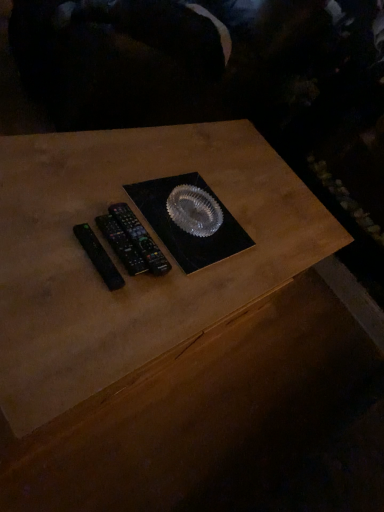
Question: Is black plastic remote at left, the second control from the back, completely or partially inside black plastic remote controls at center, which is the 1th control from back to front?

Choices:
 (A) yes
 (B) no

Answer: (B)

Question: Is black plastic remote controls at center, which is the 1th control from back to front, smaller than black plastic remote at left, positioned as the second control in front-to-back order?

Choices:
 (A) yes
 (B) no

Answer: (B)

Question: Considering the relative sizes of black plastic remote controls at center, acting as the 3th control starting from the front, and black plastic remote at left, the second control from the back, in the image provided, is black plastic remote controls at center, acting as the 3th control starting from the front, thinner than black plastic remote at left, the second control from the back,?

Choices:
 (A) yes
 (B) no

Answer: (B)

Question: Is black plastic remote controls at center, which is the 1th control from back to front, at the right side of black plastic remote at left, the second control from the back?

Choices:
 (A) no
 (B) yes

Answer: (B)

Question: From the image's perspective, is black plastic remote controls at center, which is the 1th control from back to front, below black plastic remote at left, positioned as the second control in front-to-back order?

Choices:
 (A) no
 (B) yes

Answer: (A)

Question: In terms of height, does black plastic remote at left, the 1th control viewed from the front, look taller or shorter compared to black plastic remote at left, the second control from the back?

Choices:
 (A) short
 (B) tall

Answer: (A)

Question: Is point (97, 245) positioned closer to the camera than point (142, 263)?

Choices:
 (A) farther
 (B) closer

Answer: (B)

Question: In the image, is black plastic remote at left, the 1th control viewed from the front, positioned in front of or behind black plastic remote at left, the second control from the back?

Choices:
 (A) front
 (B) behind

Answer: (A)

Question: From a real-world perspective, is black plastic remote at left, placed as the third control when sorted from back to front, positioned above or below black plastic remote at left, the second control from the back?

Choices:
 (A) above
 (B) below

Answer: (A)

Question: Does point (135, 249) appear closer or farther from the camera than point (120, 211)?

Choices:
 (A) farther
 (B) closer

Answer: (B)

Question: From their relative heights in the image, would you say black plastic remote at left, positioned as the second control in front-to-back order, is taller or shorter than black plastic remote controls at center, which is the 1th control from back to front?

Choices:
 (A) short
 (B) tall

Answer: (A)

Question: Considering the positions of black plastic remote at left, the second control from the back, and black plastic remote controls at center, which is the 1th control from back to front, in the image, is black plastic remote at left, the second control from the back, wider or thinner than black plastic remote controls at center, which is the 1th control from back to front,?

Choices:
 (A) wide
 (B) thin

Answer: (B)

Question: Considering their positions, is black plastic remote at left, positioned as the second control in front-to-back order, located in front of or behind black plastic remote controls at center, which is the 1th control from back to front?

Choices:
 (A) behind
 (B) front

Answer: (B)

Question: From the image's perspective, is black plastic remote controls at center, which is the 1th control from back to front, above or below black plastic remote at left, the second control from the back?

Choices:
 (A) above
 (B) below

Answer: (A)

Question: Is black plastic remote controls at center, which is the 1th control from back to front, bigger or smaller than black plastic remote at left, the second control from the back?

Choices:
 (A) big
 (B) small

Answer: (A)